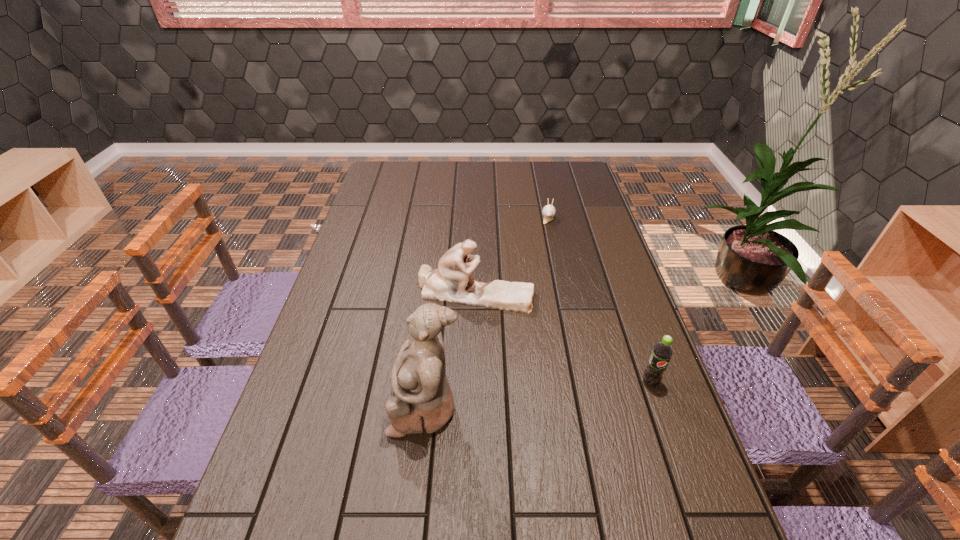
Identify the location of vacant space located 0.170m on the front label of the soda. The width and height of the screenshot is (960, 540). (677, 457).

At what (x,y) coordinates should I click in order to perform the action: click on free space located 0.290m on the shell of the farthest object. Please return your answer as a coordinate pair (x, y). Looking at the image, I should click on (544, 276).

Where is `free space located on the shell of the farthest object`? free space located on the shell of the farthest object is located at coordinates (542, 298).

You are a GUI agent. You are given a task and a screenshot of the screen. Output one action in this format:
    pyautogui.click(x=<x>, y=<y>)
    Task: Click on the vacant space located 0.250m on the shell of the farthest object
    
    Given the screenshot: What is the action you would take?
    pyautogui.click(x=545, y=268)

Identify the location of free space located 0.320m on the front-facing side of the farther figurine. (588, 388).

Locate an element on the screen. The image size is (960, 540). vacant space located 0.110m on the front-facing side of the farther figurine is located at coordinates (534, 334).

Where is `free location located on the front-facing side of the farther figurine`? This screenshot has height=540, width=960. free location located on the front-facing side of the farther figurine is located at coordinates (612, 412).

You are a GUI agent. You are given a task and a screenshot of the screen. Output one action in this format:
    pyautogui.click(x=<x>, y=<y>)
    Task: Click on the object positioned at the right edge
    Image resolution: width=960 pixels, height=540 pixels.
    Given the screenshot: What is the action you would take?
    pyautogui.click(x=662, y=352)

You are a GUI agent. You are given a task and a screenshot of the screen. Output one action in this format:
    pyautogui.click(x=<x>, y=<y>)
    Task: Click on the free spot at the far edge of the desktop
    Image resolution: width=960 pixels, height=540 pixels.
    Given the screenshot: What is the action you would take?
    pyautogui.click(x=451, y=167)

The width and height of the screenshot is (960, 540). Find the location of `vacant space at the near edge`. vacant space at the near edge is located at coordinates (507, 511).